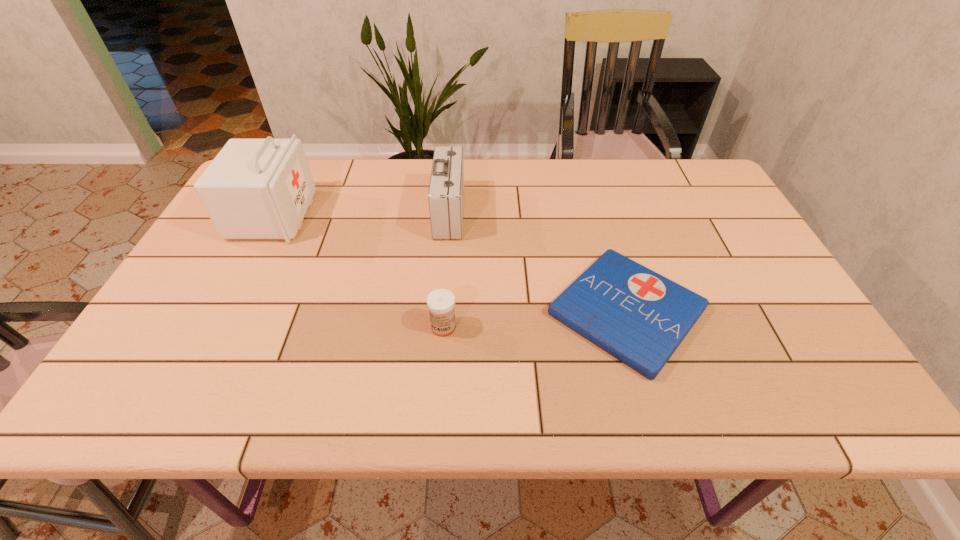
Identify the location of free space between the medicine and the leftmost object. (358, 272).

In order to click on empty space between the shortest first-aid kit and the medicine in this screenshot , I will do `click(535, 319)`.

You are a GUI agent. You are given a task and a screenshot of the screen. Output one action in this format:
    pyautogui.click(x=<x>, y=<y>)
    Task: Click on the free spot between the shortest first-aid kit and the medicine
    This screenshot has height=540, width=960.
    Given the screenshot: What is the action you would take?
    pyautogui.click(x=535, y=319)

You are a GUI agent. You are given a task and a screenshot of the screen. Output one action in this format:
    pyautogui.click(x=<x>, y=<y>)
    Task: Click on the vacant point located between the leftmost first-aid kit and the medicine
    
    Given the screenshot: What is the action you would take?
    pyautogui.click(x=358, y=272)

At what (x,y) coordinates should I click in order to perform the action: click on blank region between the shortest object and the leftmost first-aid kit. Please return your answer as a coordinate pair (x, y). Looking at the image, I should click on (450, 264).

Identify the location of vacant area between the shortest first-aid kit and the second first-aid kit from left to right. Image resolution: width=960 pixels, height=540 pixels. (538, 262).

This screenshot has width=960, height=540. Find the location of `free space between the second tallest object and the nearest first-aid kit`. free space between the second tallest object and the nearest first-aid kit is located at coordinates (538, 262).

Where is `free spot between the leftmost object and the rightmost object`? This screenshot has width=960, height=540. free spot between the leftmost object and the rightmost object is located at coordinates (450, 264).

Find the location of a particular element. vacant area that lies between the third tallest object and the shortest object is located at coordinates (535, 319).

Where is `the second closest object to the second shortest first-aid kit`? the second closest object to the second shortest first-aid kit is located at coordinates (441, 302).